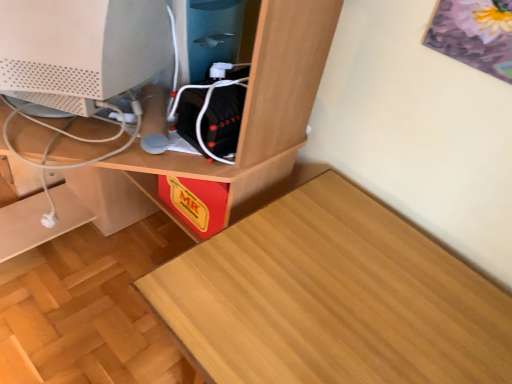
Question: Is wooden desk at center taller or shorter than wooden table at lower left?

Choices:
 (A) short
 (B) tall

Answer: (B)

Question: In the image, is wooden desk at center on the left side or the right side of wooden table at lower left?

Choices:
 (A) left
 (B) right

Answer: (A)

Question: Estimate the real-world distances between objects in this image. Which object is farther from the white matte computer monitor at center?

Choices:
 (A) wooden table at lower left
 (B) wooden desk at center

Answer: (A)

Question: Which is nearer to the wooden table at lower left?

Choices:
 (A) wooden desk at center
 (B) white matte computer monitor at center

Answer: (A)